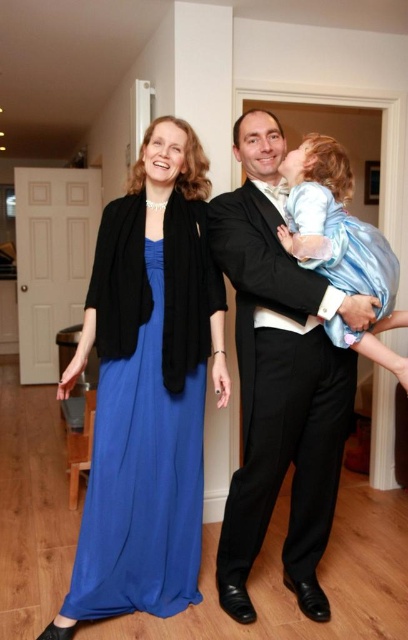
Based on the photo, is blue silk dress at left positioned behind shiny black suit at center?

Yes.

Between blue silk dress at left and shiny black suit at center, which one appears on the right side from the viewer's perspective?

shiny black suit at center

Image resolution: width=408 pixels, height=640 pixels. Identify the location of blue silk dress at left. (148, 387).

Consider the image. Who is lower down, shiny black suit at center or silky blue dress at center?

Positioned lower is shiny black suit at center.

Is shiny black suit at center bigger than silky blue dress at center?

Indeed, shiny black suit at center has a larger size compared to silky blue dress at center.

Locate an element on the screen. This screenshot has height=640, width=408. shiny black suit at center is located at coordinates (279, 380).

Can you confirm if blue silk dress at left is shorter than silky blue dress at center?

No.

Locate an element on the screen. The width and height of the screenshot is (408, 640). blue silk dress at left is located at coordinates (148, 387).